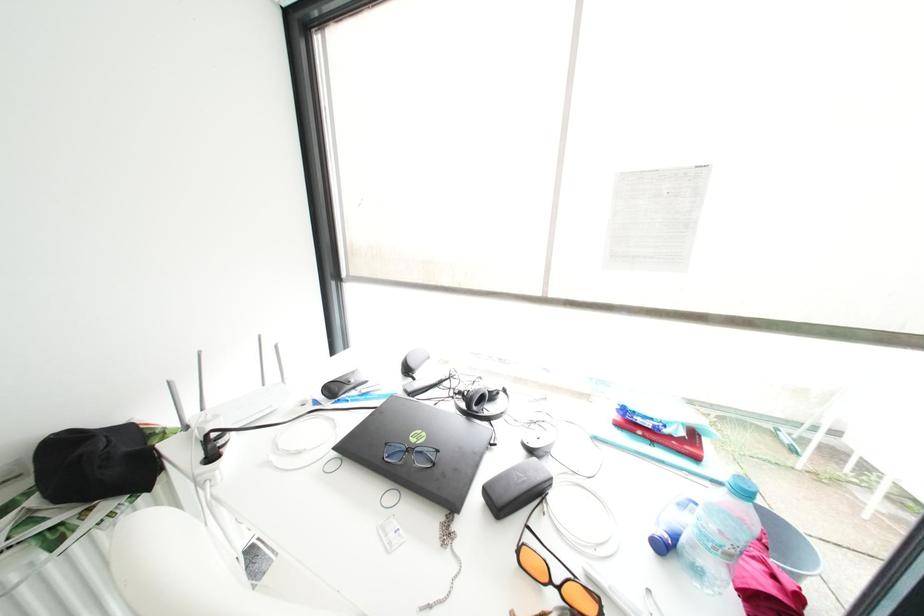
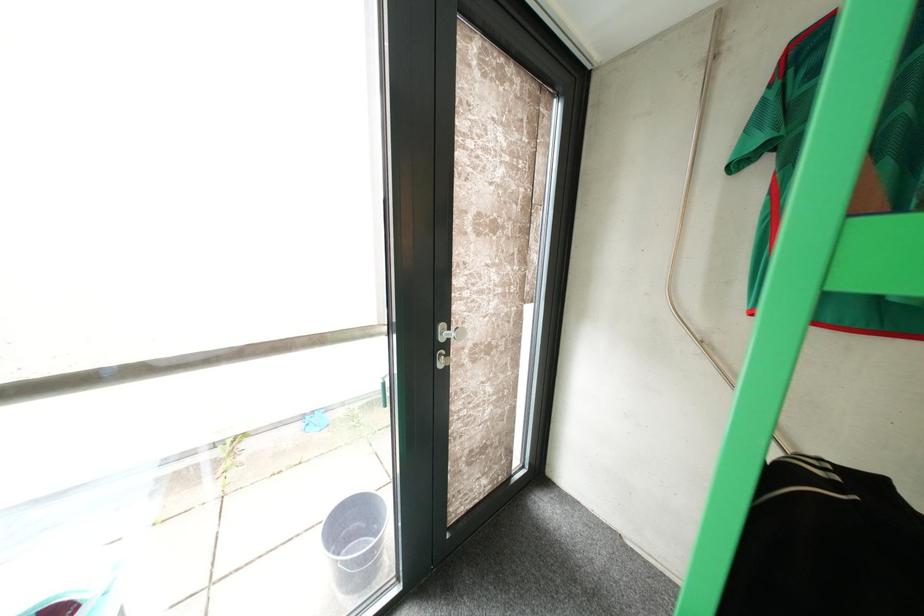
Question: The camera is either moving clockwise (left) or counter-clockwise (right) around the object. The first image is from the beginning of the video and the second image is from the end. Is the camera moving left or right when shooting the video?

Choices:
 (A) Left
 (B) Right

Answer: (A)